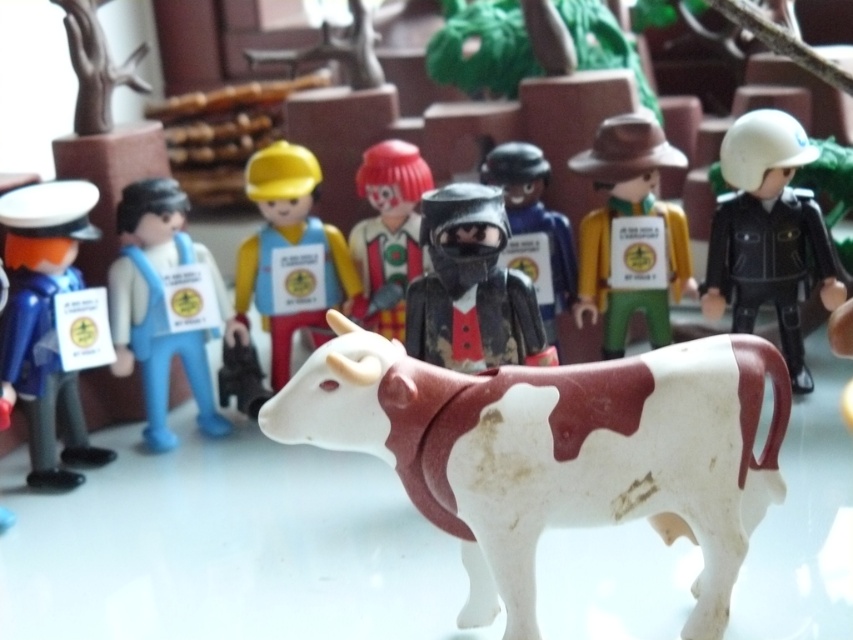
Can you confirm if blue plastic worker at center-left is positioned below matte plastic clown at center?

Yes, blue plastic worker at center-left is below matte plastic clown at center.

Identify the location of blue plastic worker at center-left. (164, 305).

What do you see at coordinates (556, 451) in the screenshot? This screenshot has height=640, width=853. I see `white matte plastic bull at center` at bounding box center [556, 451].

Is white matte plastic bull at center positioned in front of matte black knight helmet at center?

That is True.

In order to click on white matte plastic bull at center in this screenshot , I will do `click(556, 451)`.

Image resolution: width=853 pixels, height=640 pixels. In order to click on white matte plastic bull at center in this screenshot , I will do `click(556, 451)`.

Who is more forward, (746, 260) or (367, 168)?

Positioned in front is point (746, 260).

At what (x,y) coordinates should I click in order to perform the action: click on black matte helmet at upper right. Please return your answer as a coordinate pair (x, y). Looking at the image, I should click on (769, 234).